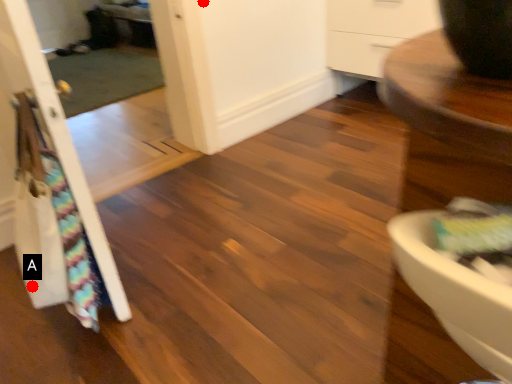
Question: Two points are circled on the image, labeled by A and B beside each circle. Which point is farther to the camera?

Choices:
 (A) A is further
 (B) B is further

Answer: (B)